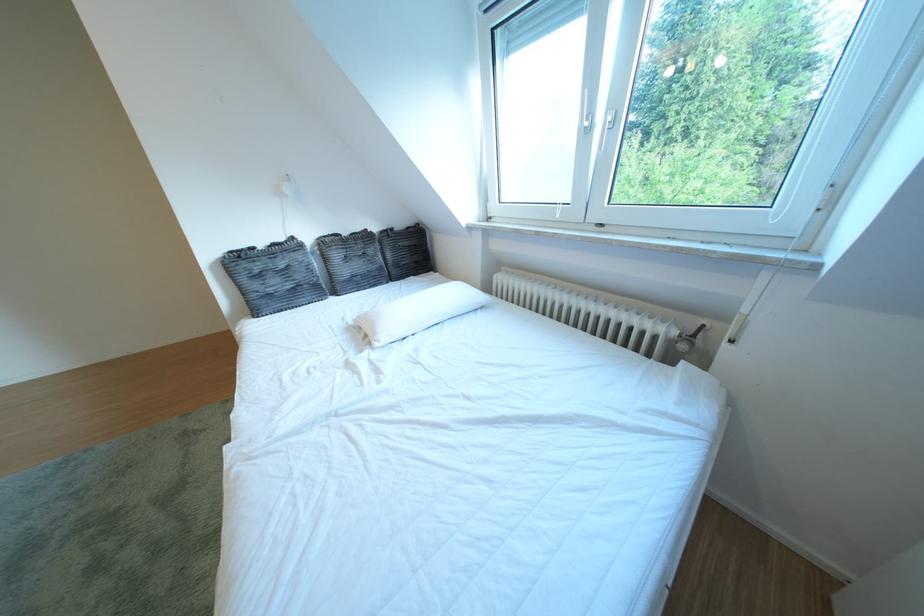
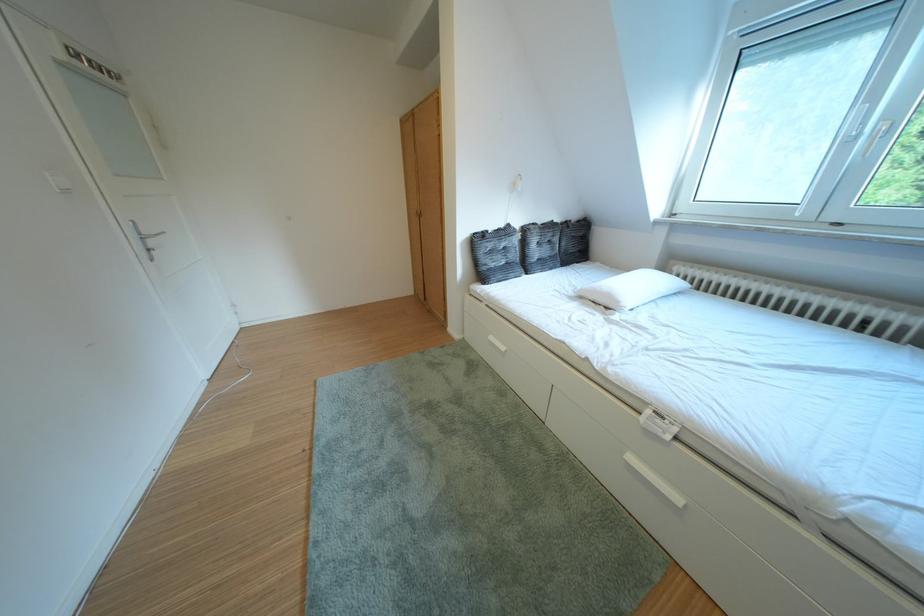
Locate, in the second image, the point that corresponds to (x=266, y=254) in the first image.

(500, 237)